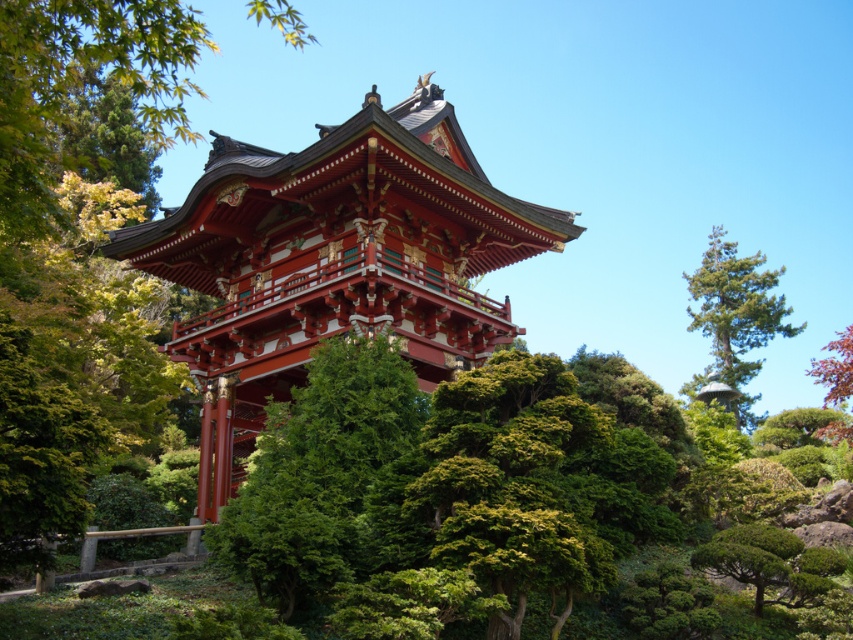
Looking at the traditional Japanese pagoda, you notice a green leafy tree at upper left and shiny red leaves at upper right. Which of these two has a bigger size?

The green leafy tree at upper left is larger in size than the shiny red leaves at upper right.